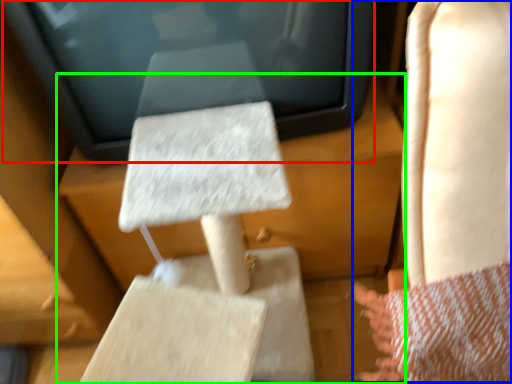
Question: Considering the real-world distances, which object is farthest from electronic (highlighted by a red box)? rocking chair (highlighted by a blue box) or furniture (highlighted by a green box)?

Choices:
 (A) rocking chair
 (B) furniture

Answer: (A)